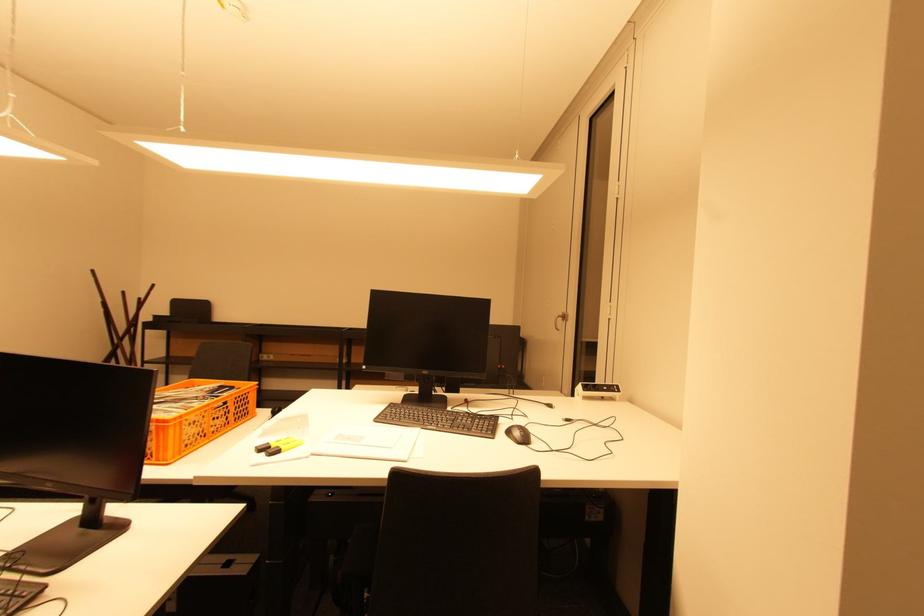
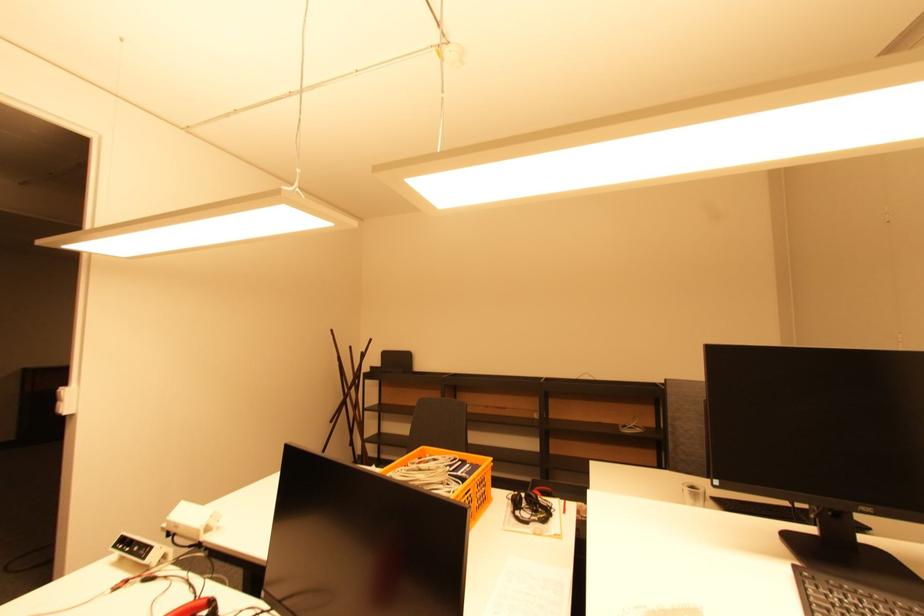
In a continuous first-person perspective shot, in which direction is the camera moving?

The movement direction of the cameraman is left, forward.